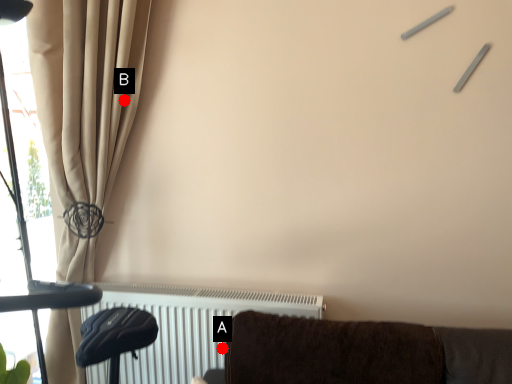
Question: Two points are circled on the image, labeled by A and B beside each circle. Which of the following is the farthest from the observer?

Choices:
 (A) A is further
 (B) B is further

Answer: (B)